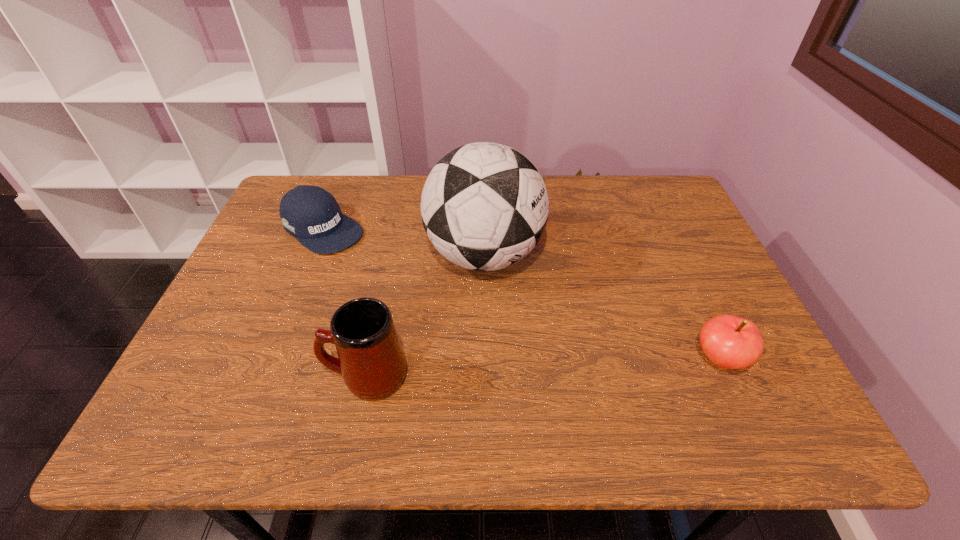
The height and width of the screenshot is (540, 960). In order to click on free space located 0.160m on the back of the apple in this screenshot , I will do `click(686, 287)`.

Locate an element on the screen. This screenshot has height=540, width=960. blank area located on the surface of the tallest object where the brand logo is visible is located at coordinates (586, 376).

You are a GUI agent. You are given a task and a screenshot of the screen. Output one action in this format:
    pyautogui.click(x=<x>, y=<y>)
    Task: Click on the free space located on the surface of the tallest object where the brand logo is visible
    The image size is (960, 540).
    Given the screenshot: What is the action you would take?
    pyautogui.click(x=547, y=330)

At what (x,y) coordinates should I click in order to perform the action: click on blank space located 0.300m on the surface of the tallest object where the brand logo is visible. Please return your answer as a coordinate pair (x, y). The image size is (960, 540). Looking at the image, I should click on pyautogui.click(x=592, y=383).

This screenshot has height=540, width=960. In order to click on vacant space located 0.310m on the front-facing side of the baseball cap in this screenshot , I will do `click(427, 301)`.

The height and width of the screenshot is (540, 960). In order to click on free space located 0.160m on the front-facing side of the baseball cap in this screenshot , I will do `click(387, 273)`.

In order to click on vacant point located on the front-facing side of the baseball cap in this screenshot , I will do `click(421, 296)`.

Locate an element on the screen. soccer ball that is at the far edge is located at coordinates pyautogui.click(x=484, y=206).

You are a GUI agent. You are given a task and a screenshot of the screen. Output one action in this format:
    pyautogui.click(x=<x>, y=<y>)
    Task: Click on the baseball cap at the far edge
    The image size is (960, 540).
    Given the screenshot: What is the action you would take?
    pyautogui.click(x=311, y=214)

Find the location of a particular element. The height and width of the screenshot is (540, 960). mug positioned at the near edge is located at coordinates (370, 358).